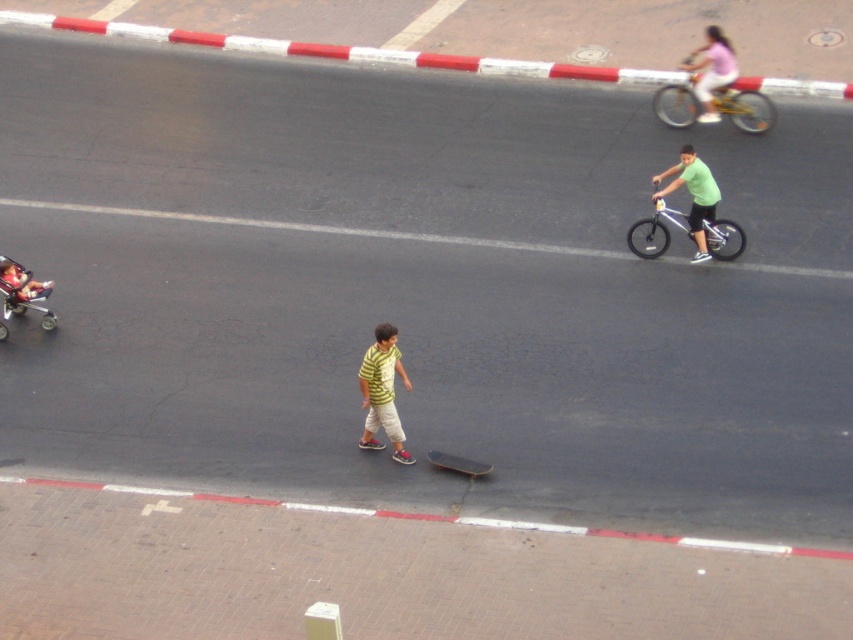
You are a photographer trying to capture a wide shot of the street scene. You notice the pink fabric shirt at upper right and the metallic silver stroller at left in your frame. Based on their sizes in the image, which object would require you to zoom out more to ensure both are fully visible?

The metallic silver stroller at left is wider than the pink fabric shirt at upper right, so you would need to zoom out more to include the metallic silver stroller at left in the frame.

You are a parent watching your children play in the street scene. You notice the green matte shirt at center and the smooth black skateboard at center. Which object is positioned higher relative to the ground?

The green matte shirt at center is above the smooth black skateboard at center, so the green matte shirt at center is higher relative to the ground.